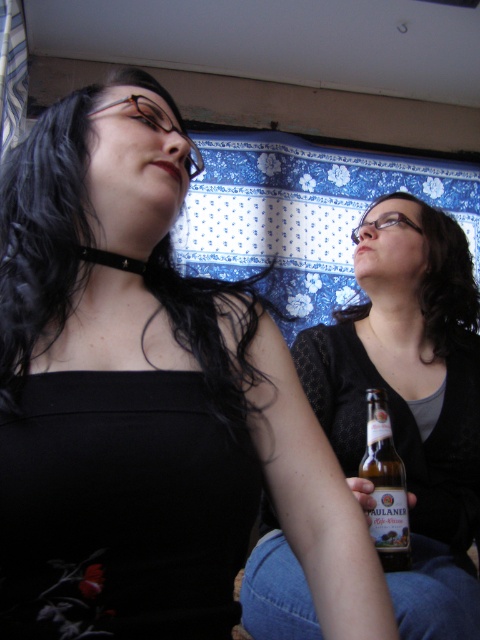
Is matte black hair at upper right thinner than golden glass beer bottle at center?

No.

Who is more forward, (433, 236) or (385, 486)?

Positioned in front is point (385, 486).

Locate an element on the screen. The height and width of the screenshot is (640, 480). matte black hair at upper right is located at coordinates (444, 276).

Can you confirm if matte black shirt at center is positioned to the left of golden glass beer bottle at center?

Incorrect, matte black shirt at center is not on the left side of golden glass beer bottle at center.

Which of these two, matte black shirt at center or golden glass beer bottle at center, stands taller?

matte black shirt at center

Who is more distant from viewer, (427, 236) or (393, 481)?

The point (427, 236) is more distant.

This screenshot has width=480, height=640. I want to click on matte black shirt at center, so click(x=410, y=397).

Can you confirm if matte black shirt at center is bigger than matte black hair at upper right?

Yes.

Between matte black shirt at center and matte black hair at upper right, which one appears on the left side from the viewer's perspective?

From the viewer's perspective, matte black shirt at center appears more on the left side.

Does point (416, 474) lie behind point (408, 198)?

No, (416, 474) is in front of (408, 198).

At what (x,y) coordinates should I click in order to perform the action: click on matte black shirt at center. Please return your answer as a coordinate pair (x, y). Looking at the image, I should click on (410, 397).